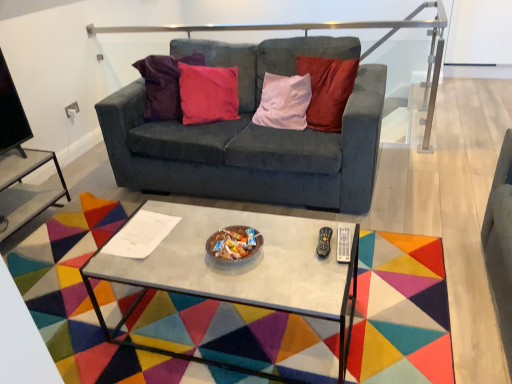
Question: Is point (429, 79) positioned closer to the camera than point (303, 243)?

Choices:
 (A) closer
 (B) farther

Answer: (B)

Question: Based on their sizes in the image, would you say satin silver rail at upper center is bigger or smaller than metallic gray coffee table at center?

Choices:
 (A) big
 (B) small

Answer: (A)

Question: Which object is the farthest from the metallic gray coffee table at center?

Choices:
 (A) metallic silver side table at lower left
 (B) velvet dark gray couch at center
 (C) satin silver rail at upper center

Answer: (C)

Question: Which of these objects is positioned closest to the metallic gray coffee table at center?

Choices:
 (A) velvet dark gray couch at center
 (B) satin silver rail at upper center
 (C) metallic silver side table at lower left

Answer: (A)